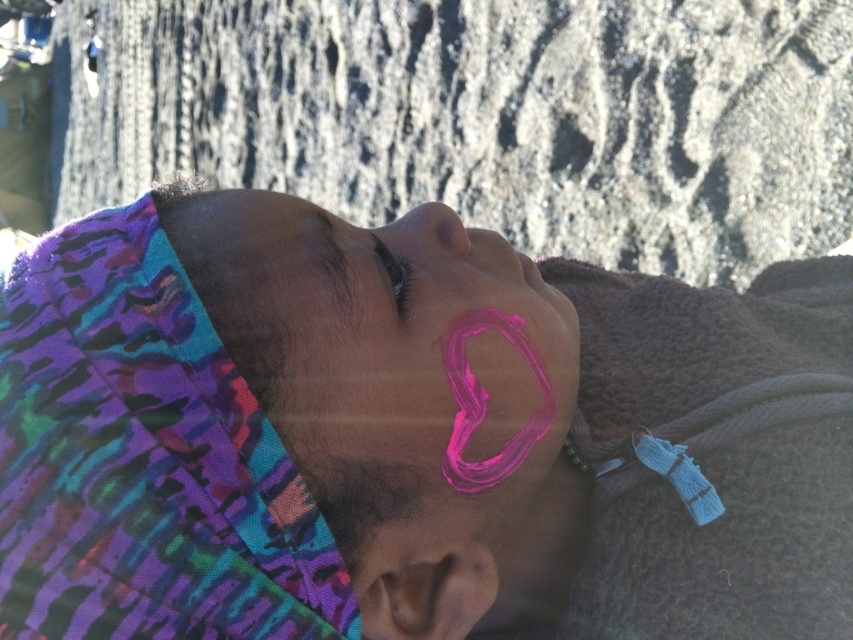
Question: Is pink matte face paint at center positioned in front of black matte eye at upper center?

Choices:
 (A) yes
 (B) no

Answer: (A)

Question: Does pink matte face paint at center come behind pink matte heart at center?

Choices:
 (A) no
 (B) yes

Answer: (A)

Question: Among these objects, which one is nearest to the camera?

Choices:
 (A) black matte eye at upper center
 (B) pink matte face paint at center
 (C) purple fabric headscarf at left
 (D) pink matte heart at center

Answer: (C)

Question: Considering the real-world distances, which object is closest to the purple fabric headscarf at left?

Choices:
 (A) black matte eye at upper center
 (B) pink matte face paint at center
 (C) pink matte heart at center

Answer: (B)

Question: Which point appears closest to the camera in this image?

Choices:
 (A) (399, 250)
 (B) (381, 250)
 (C) (252, 384)
 (D) (38, 550)

Answer: (D)

Question: Is purple fabric headscarf at left to the left of pink matte face paint at center from the viewer's perspective?

Choices:
 (A) yes
 (B) no

Answer: (A)